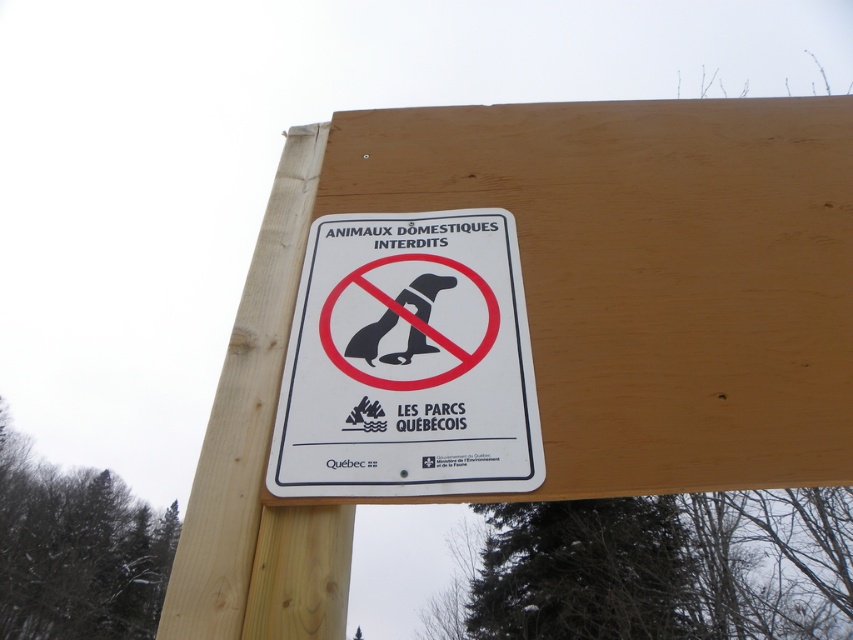
Find the location of a particular element. white plastic sign at center is located at coordinates (407, 362).

Who is positioned more to the left, white plastic sign at center or wooden post at center?

Positioned to the left is wooden post at center.

Which is behind, point (329, 454) or point (212, 529)?

The point (329, 454) is behind.

I want to click on white plastic sign at center, so click(407, 362).